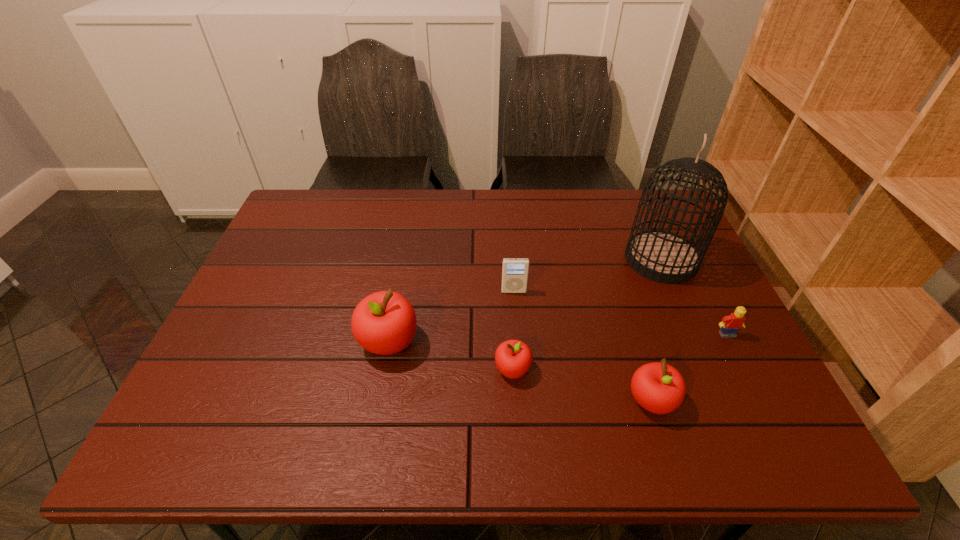
This screenshot has width=960, height=540. I want to click on the fifth shortest object, so click(x=384, y=323).

Where is `the tallest apple`? The height and width of the screenshot is (540, 960). the tallest apple is located at coordinates (384, 323).

The height and width of the screenshot is (540, 960). Find the location of `the second apple from left to right`. the second apple from left to right is located at coordinates (513, 358).

Identify the location of the rightmost apple. This screenshot has height=540, width=960. (658, 387).

Find the location of a particular element. Image resolution: width=960 pixels, height=540 pixels. the farthest object is located at coordinates (661, 256).

Identify the location of birdcage. This screenshot has width=960, height=540. (661, 256).

Locate an element on the screen. The height and width of the screenshot is (540, 960). the fifth nearest object is located at coordinates (514, 270).

Find the location of a particular element. This screenshot has height=540, width=960. Lego is located at coordinates (730, 324).

Locate an element on the screen. The width and height of the screenshot is (960, 540). vacant area situated on the back of the second tallest object is located at coordinates [405, 254].

The width and height of the screenshot is (960, 540). I want to click on vacant space located on the left of the shortest apple, so click(411, 369).